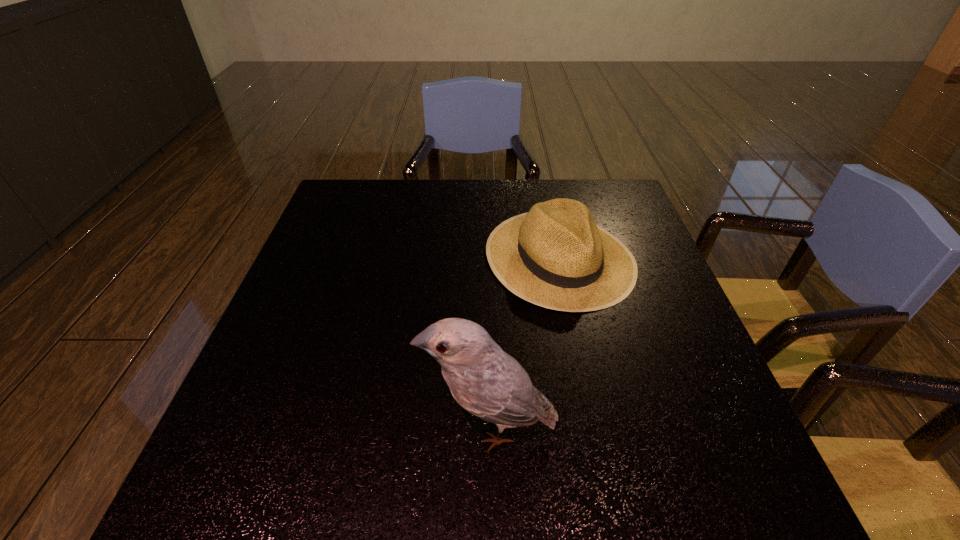
At what (x,y) coordinates should I click in order to perform the action: click on object at the far right corner. Please return your answer as a coordinate pair (x, y). This screenshot has height=540, width=960. Looking at the image, I should click on (555, 256).

This screenshot has height=540, width=960. In order to click on blank space at the far edge of the desktop in this screenshot , I will do `click(441, 180)`.

You are a GUI agent. You are given a task and a screenshot of the screen. Output one action in this format:
    pyautogui.click(x=<x>, y=<y>)
    Task: Click on the vacant space at the near edge of the desktop
    This screenshot has height=540, width=960.
    Given the screenshot: What is the action you would take?
    pyautogui.click(x=499, y=503)

At what (x,y) coordinates should I click in order to perform the action: click on vacant space at the left edge of the desktop. Please return your answer as a coordinate pair (x, y). The height and width of the screenshot is (540, 960). Looking at the image, I should click on (324, 325).

Where is `vacant area at the right edge of the desktop`? The image size is (960, 540). vacant area at the right edge of the desktop is located at coordinates (654, 335).

In the image, there is a desktop. Identify the location of vacant space at the near right corner. Image resolution: width=960 pixels, height=540 pixels. (687, 493).

Image resolution: width=960 pixels, height=540 pixels. Identify the location of free space that satisfies the following two spatial constraints: 1. on the front side of the shorter object; 2. on the front-facing side of the parrot. (595, 427).

Identify the location of free location that satisfies the following two spatial constraints: 1. on the front side of the sunhat; 2. on the front-facing side of the parrot. pos(595,427).